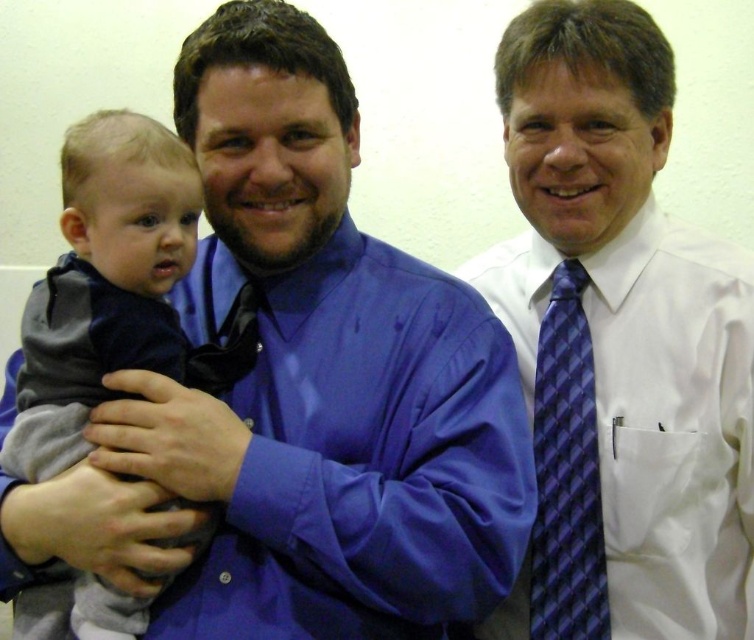
Question: Is white smooth shirt at center wider than blue checkered tie at right?

Choices:
 (A) no
 (B) yes

Answer: (B)

Question: Among these objects, which one is farthest from the camera?

Choices:
 (A) gray fleece baby at left
 (B) blue satin shirt at center
 (C) blue checkered tie at right

Answer: (C)

Question: Which of the following is the closest to the observer?

Choices:
 (A) (83, 282)
 (B) (569, 289)

Answer: (A)

Question: Can you confirm if gray fleece baby at left is positioned below blue checkered tie at right?

Choices:
 (A) yes
 (B) no

Answer: (B)

Question: Considering the real-world distances, which object is closest to the blue checkered tie at right?

Choices:
 (A) white smooth shirt at center
 (B) gray fleece baby at left
 (C) blue satin shirt at center

Answer: (A)

Question: Does blue satin shirt at center appear on the right side of blue checkered tie at right?

Choices:
 (A) yes
 (B) no

Answer: (B)